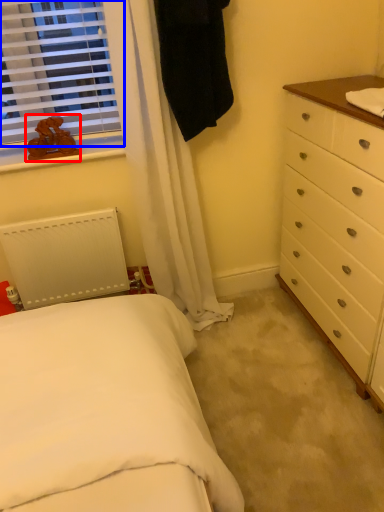
Question: Which of the following is the farthest to the observer, toy (highlighted by a red box) or window (highlighted by a blue box)?

Choices:
 (A) toy
 (B) window

Answer: (A)